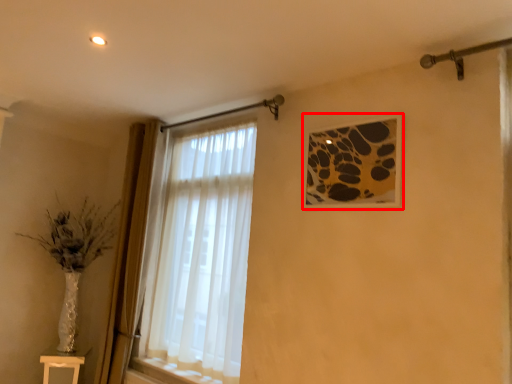
Question: From the image, what is the correct spatial relationship of picture frame (annotated by the red box) in relation to table?

Choices:
 (A) left
 (B) right

Answer: (B)